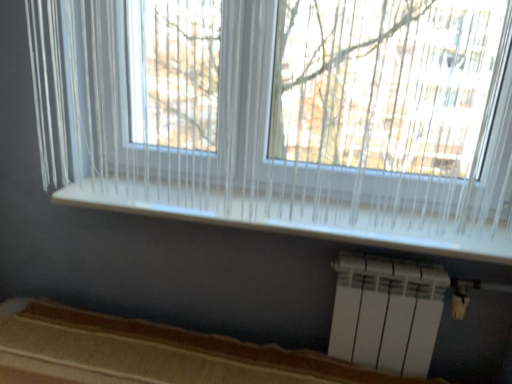
Question: Is white plastic radiator at lower right in front of or behind white wood window sill at center in the image?

Choices:
 (A) behind
 (B) front

Answer: (A)

Question: Is white plastic radiator at lower right inside the boundaries of white wood window sill at center, or outside?

Choices:
 (A) inside
 (B) outside

Answer: (B)

Question: Considering the real-world distances, which object is farthest from the white plastic radiator at lower right?

Choices:
 (A) white wood window sill at center
 (B) white translucent curtain at upper center
 (C) brown fabric bed frame at lower center

Answer: (B)

Question: Considering the real-world distances, which object is farthest from the white plastic radiator at lower right?

Choices:
 (A) white translucent curtain at upper center
 (B) white wood window sill at center
 (C) brown fabric bed frame at lower center

Answer: (A)